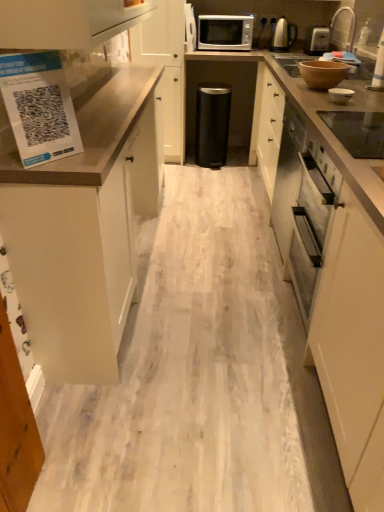
At what (x,y) coordinates should I click in order to perform the action: click on vacant space in front of white matte cabinet at left, acting as the 1th cabinetry starting from the front. Please return your answer as a coordinate pair (x, y). This screenshot has width=384, height=512. Looking at the image, I should click on [191, 378].